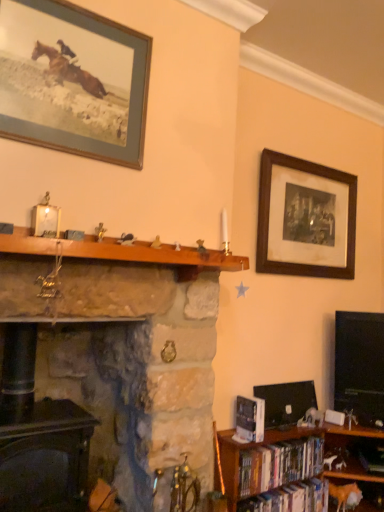
Question: Does dark wood fireplace at lower left, acting as the first fireplace starting from the left, have a smaller size compared to black glossy flat-screen tv at right?

Choices:
 (A) yes
 (B) no

Answer: (B)

Question: Is dark wood fireplace at lower left, acting as the first fireplace starting from the left, at the right side of black glossy flat-screen tv at right?

Choices:
 (A) yes
 (B) no

Answer: (B)

Question: Can you confirm if dark wood fireplace at lower left, acting as the first fireplace starting from the left, is wider than black glossy flat-screen tv at right?

Choices:
 (A) yes
 (B) no

Answer: (A)

Question: Does dark wood fireplace at lower left, positioned as the second fireplace in right-to-left order, have a greater height compared to black glossy flat-screen tv at right?

Choices:
 (A) no
 (B) yes

Answer: (A)

Question: Does dark wood fireplace at lower left, positioned as the second fireplace in right-to-left order, have a lesser height compared to black glossy flat-screen tv at right?

Choices:
 (A) yes
 (B) no

Answer: (A)

Question: Would you say hardcover books at lower right, which is the 2th book from bottom to top, is to the left or to the right of wooden bookshelf at lower right in the picture?

Choices:
 (A) right
 (B) left

Answer: (B)

Question: Based on their sizes in the image, would you say hardcover books at lower right, which is the 2th book from bottom to top, is bigger or smaller than wooden bookshelf at lower right?

Choices:
 (A) small
 (B) big

Answer: (A)

Question: Considering the positions of hardcover books at lower right, the 2th book viewed from the top, and wooden bookshelf at lower right in the image, is hardcover books at lower right, the 2th book viewed from the top, wider or thinner than wooden bookshelf at lower right?

Choices:
 (A) wide
 (B) thin

Answer: (B)

Question: From their relative heights in the image, would you say hardcover books at lower right, which is the 2th book from bottom to top, is taller or shorter than wooden bookshelf at lower right?

Choices:
 (A) short
 (B) tall

Answer: (A)

Question: From a real-world perspective, is blue matte picture frame at upper left, arranged as the second picture frame when viewed from the back, above or below black glossy flat-screen tv at right?

Choices:
 (A) below
 (B) above

Answer: (B)

Question: Considering the relative positions of blue matte picture frame at upper left, arranged as the 1th picture frame when viewed from the front, and black glossy flat-screen tv at right in the image provided, is blue matte picture frame at upper left, arranged as the 1th picture frame when viewed from the front, to the left or to the right of black glossy flat-screen tv at right?

Choices:
 (A) right
 (B) left

Answer: (B)

Question: Looking at the image, does blue matte picture frame at upper left, which is counted as the 1th picture frame, starting from the left, seem bigger or smaller compared to black glossy flat-screen tv at right?

Choices:
 (A) big
 (B) small

Answer: (B)

Question: Is point (69, 61) positioned closer to the camera than point (380, 378)?

Choices:
 (A) closer
 (B) farther

Answer: (A)

Question: In terms of height, does dark wood fireplace at lower left, acting as the first fireplace starting from the left, look taller or shorter compared to wooden bookshelf at lower right?

Choices:
 (A) short
 (B) tall

Answer: (B)

Question: Looking at the image, does dark wood fireplace at lower left, acting as the first fireplace starting from the left, seem bigger or smaller compared to wooden bookshelf at lower right?

Choices:
 (A) big
 (B) small

Answer: (B)